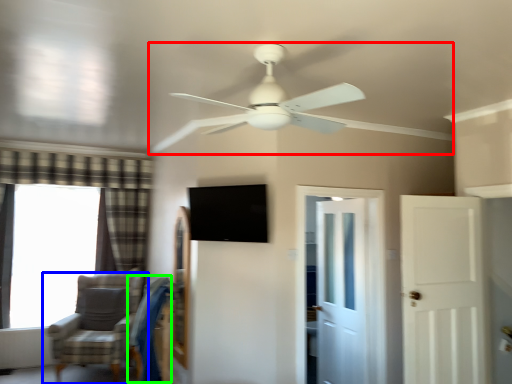
Question: Which is nearer to the ceiling fan (highlighted by a red box)? chair (highlighted by a blue box) or swivel chair (highlighted by a green box).

Choices:
 (A) chair
 (B) swivel chair

Answer: (B)